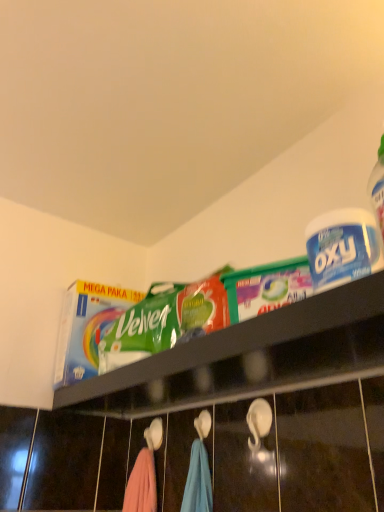
Question: From a real-world perspective, relative to white plastic container at upper right, is green plastic bag of velvet at upper center vertically above or below?

Choices:
 (A) below
 (B) above

Answer: (A)

Question: Is green plastic bag of velvet at upper center in front of or behind white plastic container at upper right in the image?

Choices:
 (A) front
 (B) behind

Answer: (A)

Question: Considering the positions of point (324, 361) and point (326, 284), is point (324, 361) closer or farther from the camera than point (326, 284)?

Choices:
 (A) farther
 (B) closer

Answer: (A)

Question: Considering their positions, is white plastic container at upper right located in front of or behind green plastic bag of velvet at upper center?

Choices:
 (A) front
 (B) behind

Answer: (B)

Question: From their relative heights in the image, would you say white plastic container at upper right is taller or shorter than green plastic bag of velvet at upper center?

Choices:
 (A) short
 (B) tall

Answer: (B)

Question: From a real-world perspective, is white plastic container at upper right physically located above or below green plastic bag of velvet at upper center?

Choices:
 (A) below
 (B) above

Answer: (B)

Question: From the image's perspective, is white plastic container at upper right located above or below green plastic bag of velvet at upper center?

Choices:
 (A) below
 (B) above

Answer: (B)